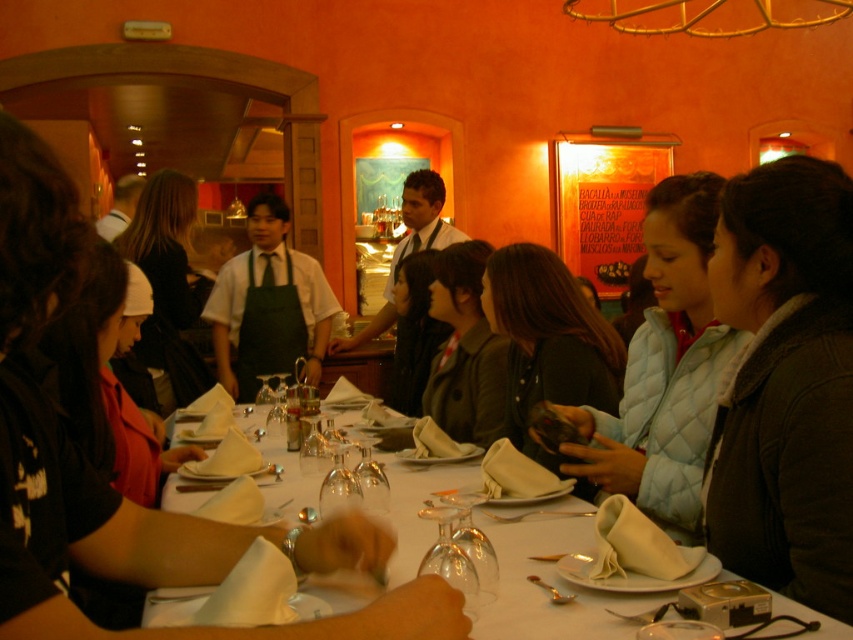
Identify the location of white cloth table at center. (549, 580).

Does white cloth table at center have a larger size compared to matte black phone at center?

No, white cloth table at center is not bigger than matte black phone at center.

I want to click on white cloth table at center, so click(549, 580).

Between point (643, 381) and point (494, 531), which one is positioned behind?

The point (643, 381) is behind.

Is light blue quilted jacket at center bigger than white cloth table at center?

Indeed, light blue quilted jacket at center has a larger size compared to white cloth table at center.

Between point (619, 465) and point (305, 476), which one is positioned behind?

Point (305, 476)

The height and width of the screenshot is (640, 853). Identify the location of light blue quilted jacket at center. (664, 369).

Which of these two, white cloth table at center or transparent glass wine glass at table center, stands taller?

Standing taller between the two is transparent glass wine glass at table center.

What do you see at coordinates (549, 580) in the screenshot? The width and height of the screenshot is (853, 640). I see `white cloth table at center` at bounding box center [549, 580].

Identify the location of white cloth table at center. (549, 580).